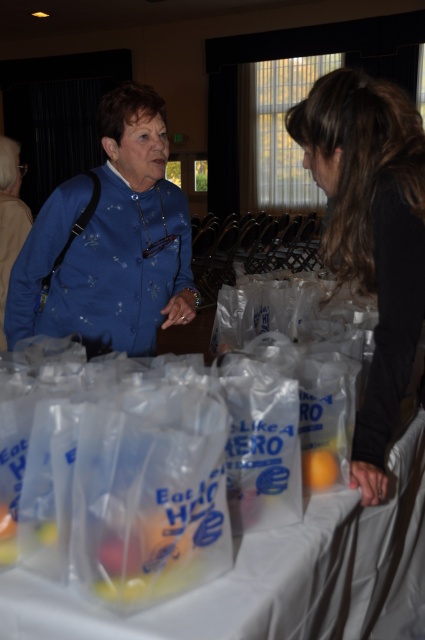
Question: Which is nearer to the orange matte/orange at center?

Choices:
 (A) white plastic bags at lower center
 (B) matte blue blouse at center
 (C) blue satin blouse at upper left
 (D) smooth black shirt at right

Answer: (A)

Question: Does matte blue blouse at center appear under orange matte/orange at center?

Choices:
 (A) no
 (B) yes

Answer: (A)

Question: Is matte blue blouse at center below smooth black shirt at right?

Choices:
 (A) yes
 (B) no

Answer: (B)

Question: Which object is closer to the camera taking this photo?

Choices:
 (A) orange matte/orange at center
 (B) white plastic bags at lower center
 (C) matte blue blouse at center
 (D) smooth black shirt at right

Answer: (B)

Question: Is white plastic bags at lower center positioned at the back of matte blue blouse at center?

Choices:
 (A) no
 (B) yes

Answer: (A)

Question: Considering the real-world distances, which object is closest to the blue satin blouse at upper left?

Choices:
 (A) matte blue blouse at center
 (B) white plastic bags at lower center
 (C) orange matte/orange at center
 (D) smooth black shirt at right

Answer: (A)